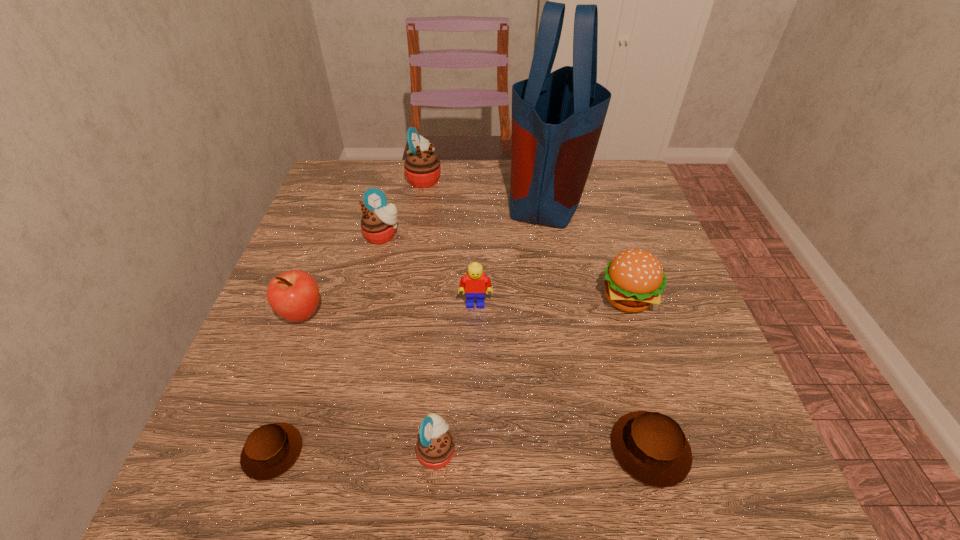
In order to click on vacant region that satisfies the following two spatial constraints: 1. on the front-facing side of the biggest pink muffin; 2. on the right side of the tallest object in this screenshot , I will do `click(421, 193)`.

Locate an element on the screen. The image size is (960, 540). free space that satisfies the following two spatial constraints: 1. on the front-facing side of the second tallest object; 2. on the front-facing side of the second biggest pink muffin is located at coordinates coord(415,235).

Find the location of a particular element. This screenshot has height=540, width=960. free space that satisfies the following two spatial constraints: 1. on the front-facing side of the yellow Lego; 2. on the front-facing side of the third shortest muffin is located at coordinates (474, 450).

This screenshot has height=540, width=960. I want to click on free point that satisfies the following two spatial constraints: 1. on the front-facing side of the second tallest object; 2. on the back side of the right brown muffin, so click(x=380, y=449).